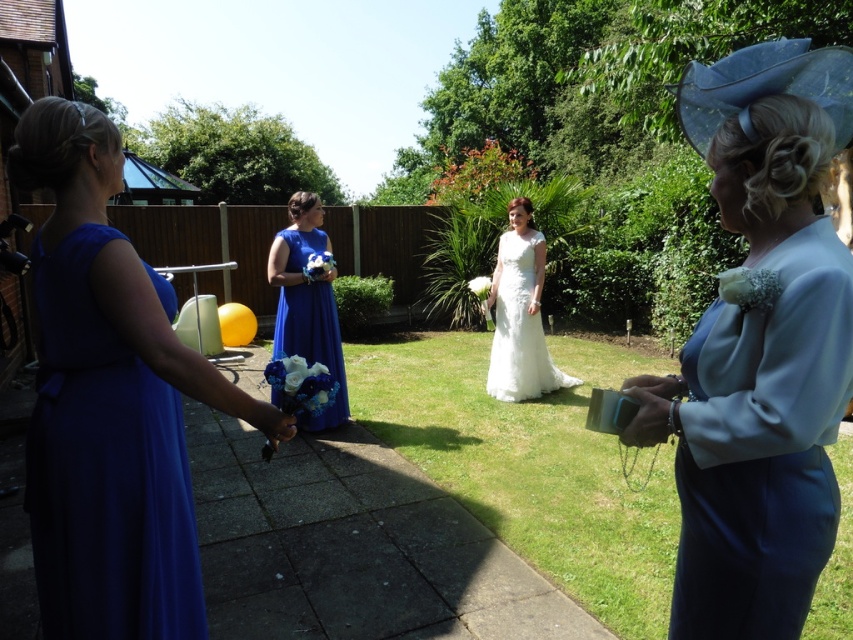
Who is shorter, white lace dress at center or royal blue satin dress at center?

Standing shorter between the two is royal blue satin dress at center.

Does point (523, 248) come behind point (343, 400)?

Yes.

Find the location of a particular element. white lace dress at center is located at coordinates (520, 314).

Locate an element on the screen. This screenshot has width=853, height=640. light blue satin dress at right is located at coordinates (759, 348).

Is light blue satin dress at right further to camera compared to royal blue satin dress at center?

No, light blue satin dress at right is closer to the viewer.

Does point (837, 362) lie in front of point (299, 272)?

Yes, it is.

Where is `light blue satin dress at right`? Image resolution: width=853 pixels, height=640 pixels. light blue satin dress at right is located at coordinates (759, 348).

Which is in front, point (62, 563) or point (306, 252)?

Point (62, 563) is more forward.

Between royal blue satin dress at left and royal blue satin dress at center, which one is positioned lower?

royal blue satin dress at left

At what (x,y) coordinates should I click in order to perform the action: click on royal blue satin dress at left. Please return your answer as a coordinate pair (x, y). Looking at the image, I should click on (103, 468).